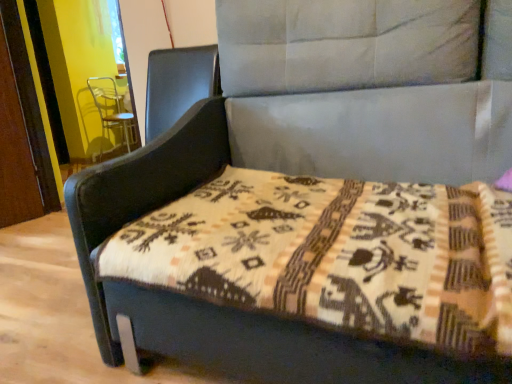
Question: Based on their positions, is metallic silver swivel chair at upper left located to the left or right of beige woven mattress at center?

Choices:
 (A) right
 (B) left

Answer: (B)

Question: Looking at the image, does metallic silver swivel chair at upper left seem bigger or smaller compared to beige woven mattress at center?

Choices:
 (A) big
 (B) small

Answer: (A)

Question: Is metallic silver swivel chair at upper left situated inside beige woven mattress at center or outside?

Choices:
 (A) inside
 (B) outside

Answer: (B)

Question: Does point (429, 226) appear closer or farther from the camera than point (112, 77)?

Choices:
 (A) farther
 (B) closer

Answer: (B)

Question: Would you say beige woven mattress at center is to the left or to the right of metallic silver swivel chair at upper left in the picture?

Choices:
 (A) left
 (B) right

Answer: (B)

Question: Considering their positions, is beige woven mattress at center located in front of or behind metallic silver swivel chair at upper left?

Choices:
 (A) behind
 (B) front

Answer: (B)

Question: Choose the correct answer: Is beige woven mattress at center inside metallic silver swivel chair at upper left or outside it?

Choices:
 (A) outside
 (B) inside

Answer: (A)